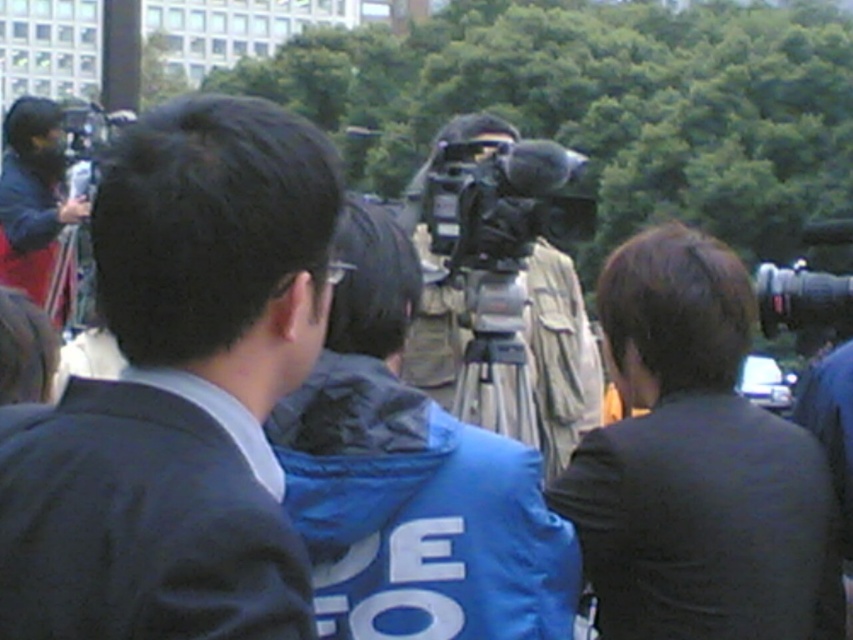
Question: Is black matte suit at left further to the viewer compared to black matte suit at right?

Choices:
 (A) no
 (B) yes

Answer: (A)

Question: Which point is farther from the camera taking this photo?

Choices:
 (A) (521, 273)
 (B) (97, 616)

Answer: (A)

Question: Considering the real-world distances, which object is farthest from the black matte suit at left?

Choices:
 (A) black matte suit at right
 (B) matte black camera at left
 (C) silver metallic tripod at center

Answer: (B)

Question: Can you confirm if black matte suit at left is positioned to the left of black matte suit at right?

Choices:
 (A) no
 (B) yes

Answer: (B)

Question: Does black matte suit at right appear on the left side of matte black camera at left?

Choices:
 (A) yes
 (B) no

Answer: (B)

Question: Based on their relative distances, which object is farther from the black matte suit at right?

Choices:
 (A) black matte suit at left
 (B) matte black camera at left
 (C) silver metallic tripod at center

Answer: (B)